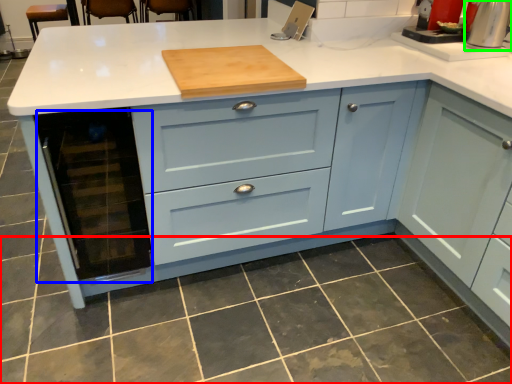
Question: Considering the real-world distances, which object is farthest from tile (highlighted by a red box)? appliance (highlighted by a blue box) or home appliance (highlighted by a green box)?

Choices:
 (A) appliance
 (B) home appliance

Answer: (B)